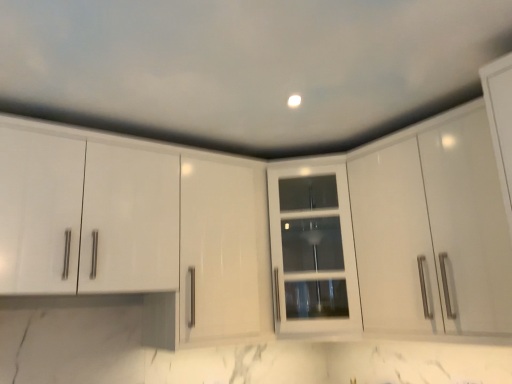
Question: Which direction should I rotate to look at white glass cabinet at center, the 2th cabinetry when ordered from right to left?

Choices:
 (A) left
 (B) right

Answer: (B)

Question: Is white glass cabinet at center, the 2th cabinetry when ordered from right to left, inside glossy white cabinet at upper right, which is counted as the second cabinetry, starting from the left?

Choices:
 (A) no
 (B) yes

Answer: (A)

Question: Is glossy white cabinet at upper right, the first cabinetry positioned from the right, positioned behind white glass cabinet at center, the 2th cabinetry when ordered from right to left?

Choices:
 (A) no
 (B) yes

Answer: (A)

Question: Is glossy white cabinet at upper right, the first cabinetry positioned from the right, bigger than white glass cabinet at center, which ranks as the first cabinetry in left-to-right order?

Choices:
 (A) yes
 (B) no

Answer: (A)

Question: Considering the relative sizes of glossy white cabinet at upper right, the first cabinetry positioned from the right, and white glass cabinet at center, the 2th cabinetry when ordered from right to left, in the image provided, is glossy white cabinet at upper right, the first cabinetry positioned from the right, shorter than white glass cabinet at center, the 2th cabinetry when ordered from right to left,?

Choices:
 (A) no
 (B) yes

Answer: (A)

Question: Is glossy white cabinet at upper right, the first cabinetry positioned from the right, positioned before white glass cabinet at center, the 2th cabinetry when ordered from right to left?

Choices:
 (A) yes
 (B) no

Answer: (A)

Question: Considering the relative sizes of glossy white cabinet at upper right, which is counted as the second cabinetry, starting from the left, and white glass cabinet at center, which ranks as the first cabinetry in left-to-right order, in the image provided, is glossy white cabinet at upper right, which is counted as the second cabinetry, starting from the left, wider than white glass cabinet at center, which ranks as the first cabinetry in left-to-right order,?

Choices:
 (A) yes
 (B) no

Answer: (B)

Question: Is the surface of white glass cabinet at center, which ranks as the first cabinetry in left-to-right order, in direct contact with glossy white cabinet at upper right, the first cabinetry positioned from the right?

Choices:
 (A) no
 (B) yes

Answer: (A)

Question: Is white glass cabinet at center, which ranks as the first cabinetry in left-to-right order, shorter than glossy white cabinet at upper right, which is counted as the second cabinetry, starting from the left?

Choices:
 (A) yes
 (B) no

Answer: (A)

Question: Can we say white glass cabinet at center, the 2th cabinetry when ordered from right to left, lies outside glossy white cabinet at upper right, the first cabinetry positioned from the right?

Choices:
 (A) no
 (B) yes

Answer: (B)

Question: From the image's perspective, is white glass cabinet at center, the 2th cabinetry when ordered from right to left, on top of glossy white cabinet at upper right, the first cabinetry positioned from the right?

Choices:
 (A) no
 (B) yes

Answer: (A)

Question: Is glossy white cabinet at upper right, the first cabinetry positioned from the right, at the back of white glass cabinet at center, which ranks as the first cabinetry in left-to-right order?

Choices:
 (A) no
 (B) yes

Answer: (A)

Question: Is white glass cabinet at center, the 2th cabinetry when ordered from right to left, closer to camera compared to glossy white cabinet at upper right, which is counted as the second cabinetry, starting from the left?

Choices:
 (A) no
 (B) yes

Answer: (A)

Question: Based on their sizes in the image, would you say white glass cabinet at center, which ranks as the first cabinetry in left-to-right order, is bigger or smaller than glossy white cabinet at upper right, the first cabinetry positioned from the right?

Choices:
 (A) small
 (B) big

Answer: (A)